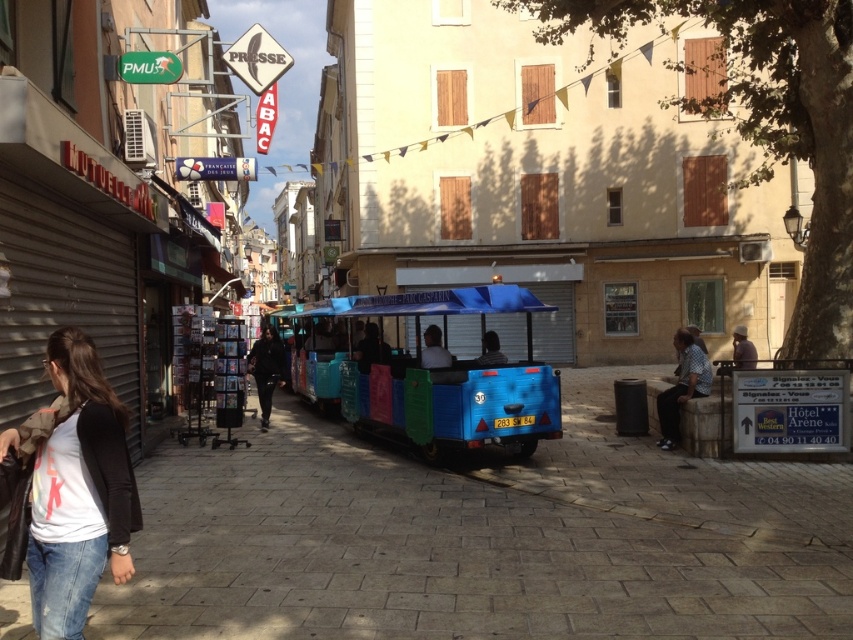
How much distance is there between blue plastic cart at center and light brown wooden bench at lower right?

A distance of 21.13 feet exists between blue plastic cart at center and light brown wooden bench at lower right.

Can you confirm if blue plastic cart at center is positioned above light brown wooden bench at lower right?

→ Incorrect, blue plastic cart at center is not positioned above light brown wooden bench at lower right.

Is point (358, 316) behind point (746, 333)?

That is False.

Where is `blue plastic cart at center`? blue plastic cart at center is located at coordinates (450, 372).

Who is higher up, patterned fabric shirt at center or light brown wooden bench at lower right?

light brown wooden bench at lower right is higher up.

Which of these two, patterned fabric shirt at center or light brown wooden bench at lower right, stands taller?

Standing taller between the two is patterned fabric shirt at center.

Locate an element on the screen. The image size is (853, 640). patterned fabric shirt at center is located at coordinates (682, 387).

Does point (343, 300) come farther from viewer compared to point (666, 396)?

That is True.

Does blue plastic cart at center appear on the right side of patterned fabric shirt at center?

In fact, blue plastic cart at center is to the left of patterned fabric shirt at center.

Is point (459, 358) positioned in front of point (683, 394)?

No, it is not.

Image resolution: width=853 pixels, height=640 pixels. I want to click on blue plastic cart at center, so click(450, 372).